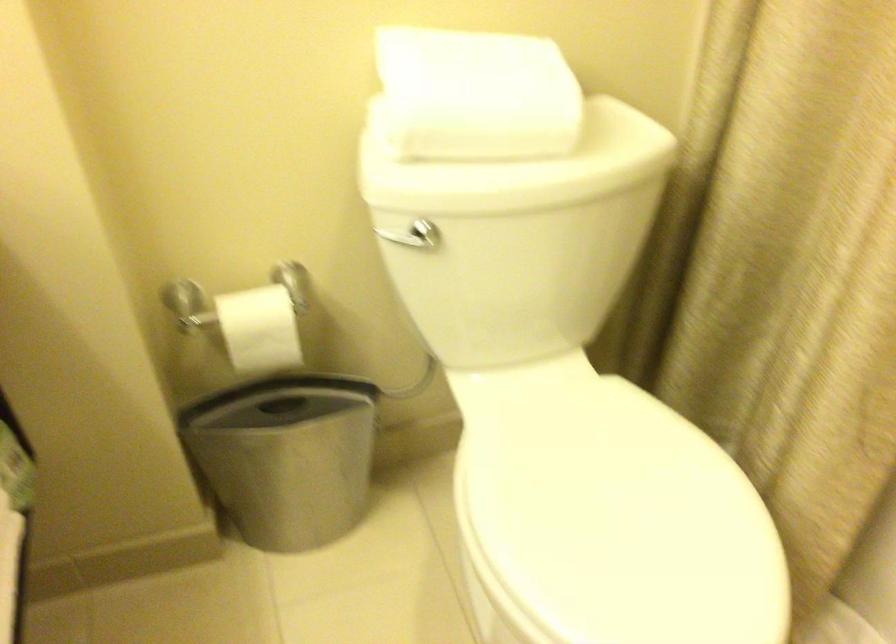
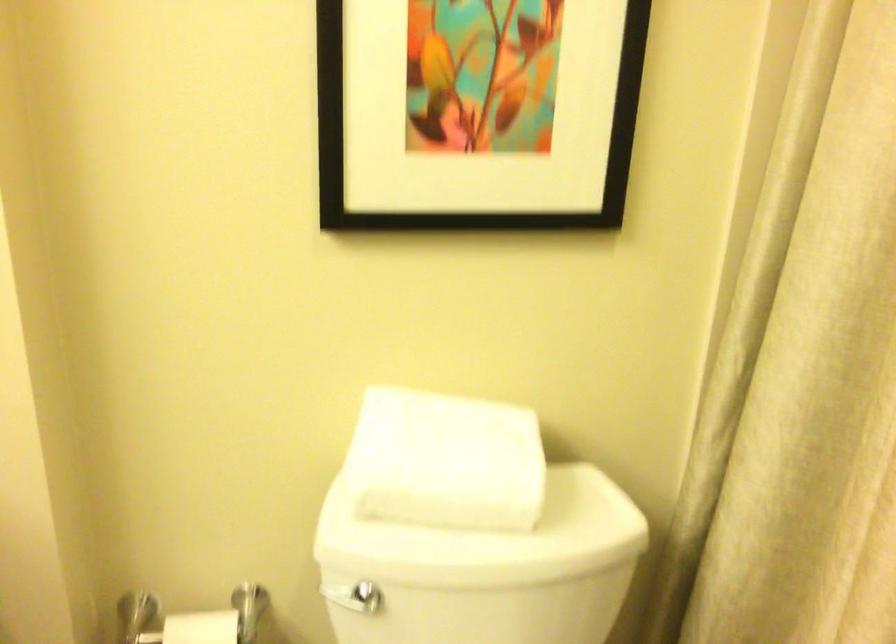
In the second image, find the point that corresponds to (481,89) in the first image.

(445, 460)